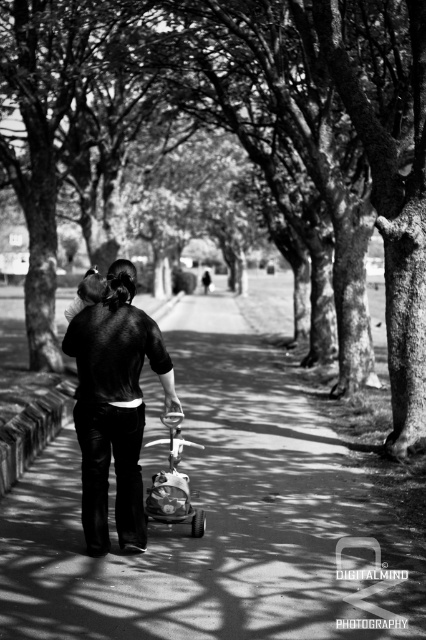
In the black and white photo, there is a dark matte jacket at center and a matte plastic baby carriage at center. Which object is positioned to the left?

The dark matte jacket at center is to the left of the matte plastic baby carriage at center.

Based on the photo, you are standing at the camera position and want to estimate how far the dark matte jacket at center is from you. Based on the scene, can you determine the distance?

The dark matte jacket at center is 24.40 feet away from the camera position.

You are standing at the entrance of the park and see the smooth concrete pavement at center and the dark matte jacket at center. Which object is located to the right side of the other?

The smooth concrete pavement at center is located to the right of the dark matte jacket at center.